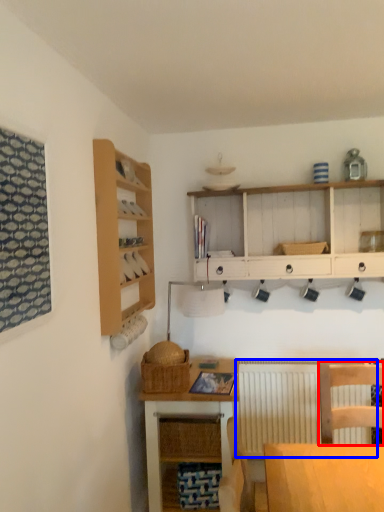
Question: Which object is further to the camera taking this photo, chair (highlighted by a red box) or radiator (highlighted by a blue box)?

Choices:
 (A) chair
 (B) radiator

Answer: (B)